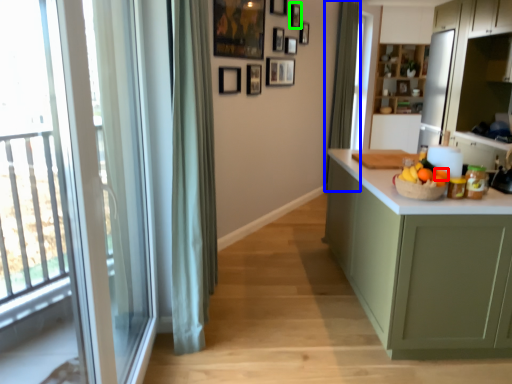
Question: Estimate the real-world distances between objects in this image. Which object is farther from orange (highlighted by a red box), curtain (highlighted by a blue box) or picture frame (highlighted by a green box)?

Choices:
 (A) curtain
 (B) picture frame

Answer: (A)